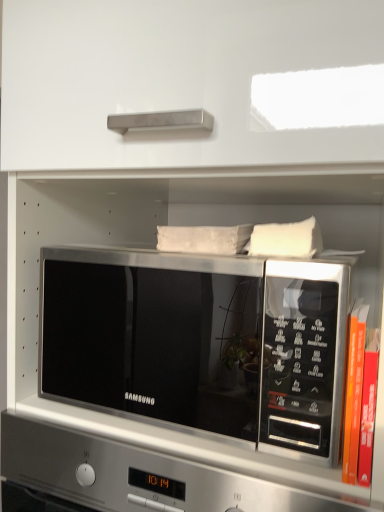
In order to face satin silver microwave at center, should I rotate leftwards or rightwards?

To face it directly, rotate right by 2.194 degrees.

Locate an element on the screen. Image resolution: width=384 pixels, height=512 pixels. white soft pillow at upper right is located at coordinates (286, 239).

What do you see at coordinates (286, 239) in the screenshot? The width and height of the screenshot is (384, 512). I see `white soft pillow at upper right` at bounding box center [286, 239].

You are a GUI agent. You are given a task and a screenshot of the screen. Output one action in this format:
    pyautogui.click(x=<x>, y=<y>)
    Task: Click on the satin silver microwave at center
    The height and width of the screenshot is (512, 384).
    Given the screenshot: What is the action you would take?
    pyautogui.click(x=198, y=343)

Which is less distant, [352,440] or [301,248]?

Point [352,440] is positioned closer to the camera compared to point [301,248].

Does orange hardcover book at right have a greater height compared to white soft pillow at upper right?

Yes.

Is white soft pillow at upper right at the back of orange hardcover book at right?

orange hardcover book at right is not turned away from white soft pillow at upper right.

Are orange hardcover book at right and white soft pillow at upper right making contact?

orange hardcover book at right and white soft pillow at upper right are clearly separated.

Considering the sizes of satin silver microwave at center and white soft pillow at upper right in the image, is satin silver microwave at center wider or thinner than white soft pillow at upper right?

In the image, satin silver microwave at center appears to be wider than white soft pillow at upper right.

From the image's perspective, is satin silver microwave at center below white soft pillow at upper right?

Yes, from the image's perspective, satin silver microwave at center is beneath white soft pillow at upper right.

Is satin silver microwave at center situated inside white soft pillow at upper right or outside?

satin silver microwave at center is located beyond the bounds of white soft pillow at upper right.

From a real-world perspective, is white soft pillow at upper right below satin silver microwave at center?

No, from a real-world perspective, white soft pillow at upper right is not below satin silver microwave at center.

Between white soft pillow at upper right and satin silver microwave at center, which one appears on the left side from the viewer's perspective?

From the viewer's perspective, satin silver microwave at center appears more on the left side.

Is white soft pillow at upper right next to satin silver microwave at center?

No, white soft pillow at upper right is not next to satin silver microwave at center.

Can you tell me how much white soft pillow at upper right and satin silver microwave at center differ in facing direction?

They differ by 3.57 degrees in their facing directions.

Is point (285, 281) positioned in front of point (352, 328)?

No, it is behind (352, 328).

From the image's perspective, between satin silver microwave at center and orange hardcover book at right, who is located below?

orange hardcover book at right is shown below in the image.

Is satin silver microwave at center turned away from orange hardcover book at right?

That's not correct — satin silver microwave at center is not looking away from orange hardcover book at right.

Between point (287, 239) and point (360, 337), which one is positioned in front?

The point (360, 337) is in front.

Consider the image. Is white soft pillow at upper right to the left or to the right of orange hardcover book at right in the image?

In the image, white soft pillow at upper right appears on the left side of orange hardcover book at right.

Considering the sizes of objects white soft pillow at upper right and orange hardcover book at right in the image provided, who is shorter, white soft pillow at upper right or orange hardcover book at right?

white soft pillow at upper right is shorter.

How distant is white soft pillow at upper right from orange hardcover book at right?

white soft pillow at upper right and orange hardcover book at right are 16.36 centimeters apart.

What's the angular difference between orange hardcover book at right and satin silver microwave at center's facing directions?

0.622 degrees separate the facing orientations of orange hardcover book at right and satin silver microwave at center.

From a real-world perspective, is orange hardcover book at right positioned above or below satin silver microwave at center?

orange hardcover book at right is below satin silver microwave at center.

Is orange hardcover book at right facing away from satin silver microwave at center?

orange hardcover book at right does not have its back to satin silver microwave at center.

The image size is (384, 512). I want to click on pillow above the orange hardcover book at right (from the image's perspective), so click(286, 239).

The width and height of the screenshot is (384, 512). What are the coordinates of `microwave oven on the left of white soft pillow at upper right` in the screenshot? It's located at (198, 343).

From the image, which object appears to be farther from orange hardcover book at right, satin silver microwave at center or white soft pillow at upper right?

satin silver microwave at center is positioned further to the anchor orange hardcover book at right.

Which object lies further to the anchor point white soft pillow at upper right, satin silver microwave at center or orange hardcover book at right?

satin silver microwave at center.

Estimate the real-world distances between objects in this image. Which object is further from satin silver microwave at center, orange hardcover book at right or white soft pillow at upper right?

Among the two, orange hardcover book at right is located further to satin silver microwave at center.

In the scene shown: From the image, which object appears to be farther from orange hardcover book at right, white soft pillow at upper right or satin silver microwave at center?

Among the two, satin silver microwave at center is located further to orange hardcover book at right.

Looking at the image, which one is located further to white soft pillow at upper right, orange hardcover book at right or satin silver microwave at center?

Among the two, satin silver microwave at center is located further to white soft pillow at upper right.

Looking at the image, which one is located further to satin silver microwave at center, white soft pillow at upper right or orange hardcover book at right?

orange hardcover book at right lies further to satin silver microwave at center than the other object.

This screenshot has height=512, width=384. Identify the location of microwave oven that lies between white soft pillow at upper right and orange hardcover book at right from top to bottom. (198, 343).